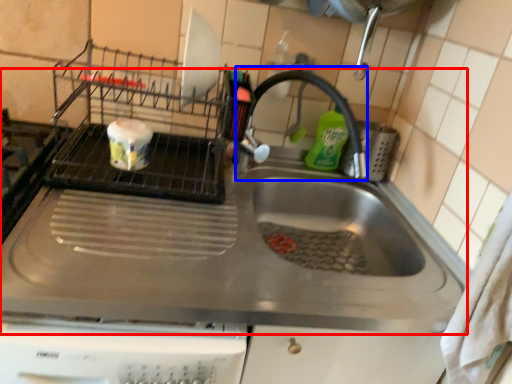
Question: Which object is closer to the camera taking this photo, sink (highlighted by a red box) or faucet (highlighted by a blue box)?

Choices:
 (A) sink
 (B) faucet

Answer: (A)